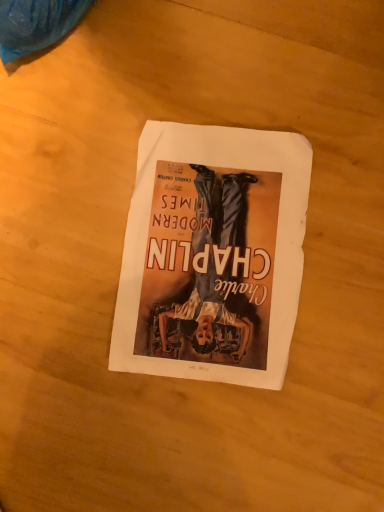
What do you see at coordinates (213, 254) in the screenshot? I see `white paper at center` at bounding box center [213, 254].

Locate an element on the screen. white paper at center is located at coordinates click(x=213, y=254).

Find the location of a particular element. Image resolution: width=384 pixels, height=512 pixels. white paper at center is located at coordinates (213, 254).